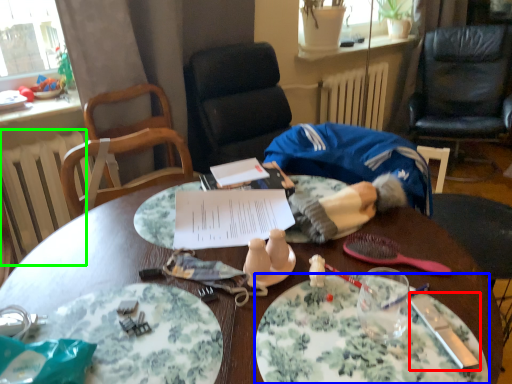
Question: Considering the real-world distances, which object is closest to knife (highlighted by a red box)? plate (highlighted by a blue box) or radiator (highlighted by a green box).

Choices:
 (A) plate
 (B) radiator

Answer: (A)